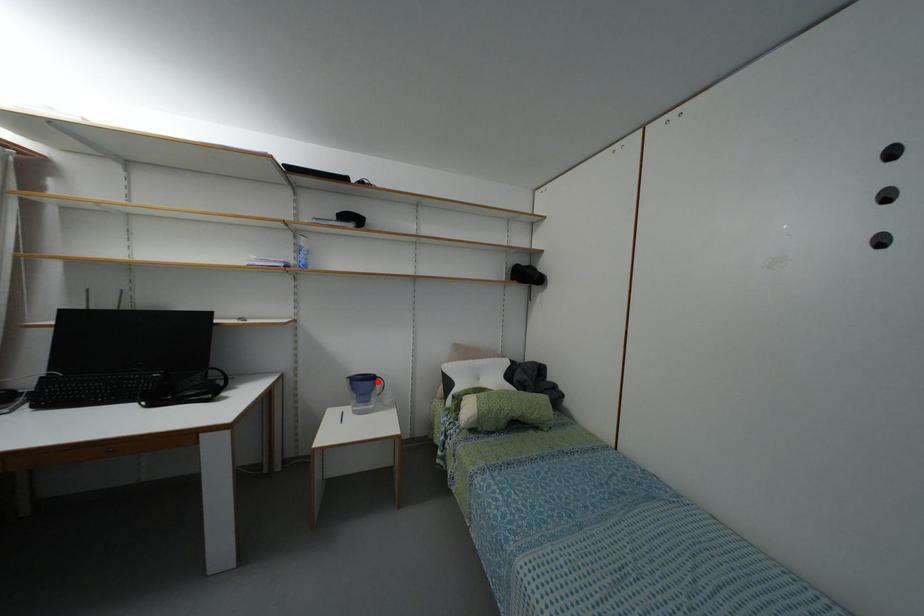
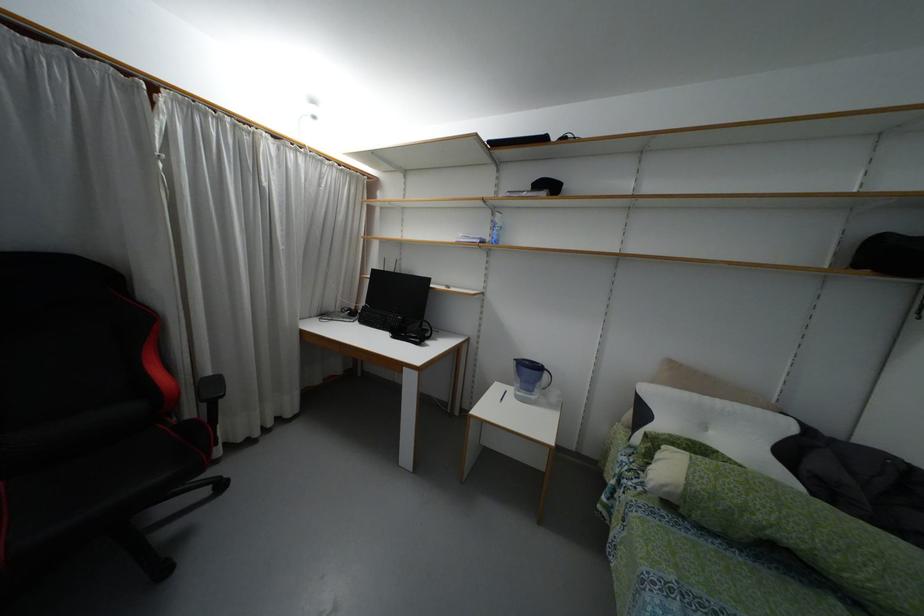
Where in the second image is the point corresponding to the highlighted location from the first image?

(544, 375)